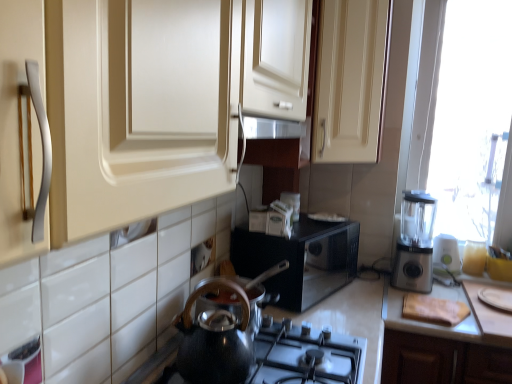
Question: Is silver metallic blender at right further to the viewer compared to shiny black kettle at lower center?

Choices:
 (A) yes
 (B) no

Answer: (A)

Question: Does silver metallic blender at right turn towards shiny black kettle at lower center?

Choices:
 (A) no
 (B) yes

Answer: (A)

Question: Is silver metallic blender at right facing away from shiny black kettle at lower center?

Choices:
 (A) no
 (B) yes

Answer: (A)

Question: From the image's perspective, is silver metallic blender at right below shiny black kettle at lower center?

Choices:
 (A) yes
 (B) no

Answer: (B)

Question: Can you confirm if silver metallic blender at right is bigger than shiny black kettle at lower center?

Choices:
 (A) no
 (B) yes

Answer: (A)

Question: From a real-world perspective, is silver metallic blender at right under shiny black kettle at lower center?

Choices:
 (A) yes
 (B) no

Answer: (B)

Question: Does silver metallic blender at right have a greater width compared to black glossy microwave at center, the 1th appliance from the left?

Choices:
 (A) no
 (B) yes

Answer: (A)

Question: Is silver metallic blender at right facing away from black glossy microwave at center, the 3th appliance when ordered from right to left?

Choices:
 (A) no
 (B) yes

Answer: (A)

Question: From a real-world perspective, is silver metallic blender at right below black glossy microwave at center, the 1th appliance from the left?

Choices:
 (A) yes
 (B) no

Answer: (B)

Question: Is silver metallic blender at right shorter than black glossy microwave at center, the 3th appliance when ordered from right to left?

Choices:
 (A) no
 (B) yes

Answer: (A)

Question: Is silver metallic blender at right further to the viewer compared to black glossy microwave at center, the 3th appliance when ordered from right to left?

Choices:
 (A) yes
 (B) no

Answer: (A)

Question: Is silver metallic blender at right to the left of black glossy microwave at center, the 3th appliance when ordered from right to left, from the viewer's perspective?

Choices:
 (A) no
 (B) yes

Answer: (A)

Question: Could you tell me if black glossy microwave at center, the 1th appliance from the left, is facing matte cream cabinet at upper center?

Choices:
 (A) no
 (B) yes

Answer: (A)